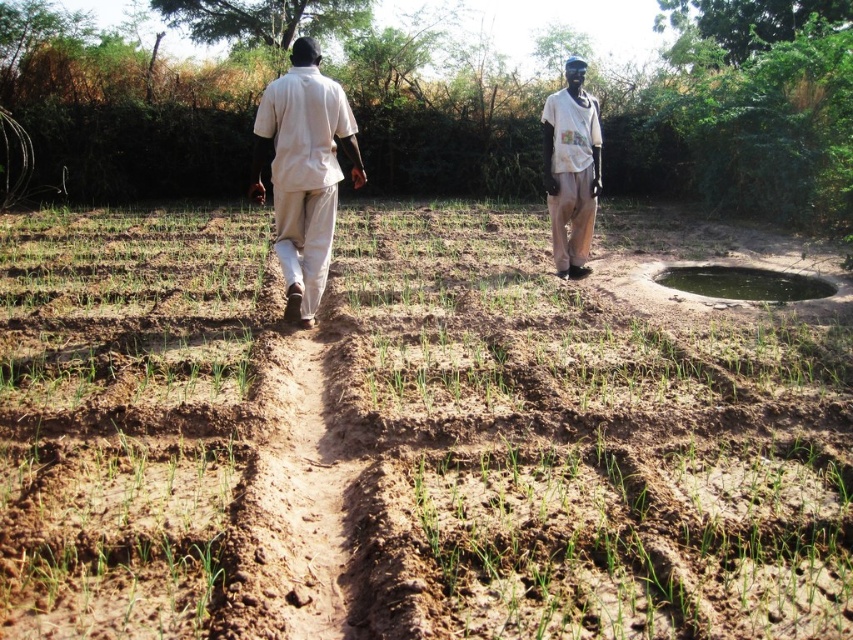
Who is shorter, light beige cotton shirt at center or white cotton shirt at upper center?

light beige cotton shirt at center

This screenshot has height=640, width=853. What do you see at coordinates (303, 172) in the screenshot? I see `light beige cotton shirt at center` at bounding box center [303, 172].

In order to click on light beige cotton shirt at center in this screenshot , I will do `click(303, 172)`.

Between point (196, 531) and point (558, 236), which one is positioned in front?

Point (196, 531)

What are the coordinates of `brown soil at center` in the screenshot? It's located at pos(415,433).

Where is `brown soil at center`? This screenshot has width=853, height=640. brown soil at center is located at coordinates (415, 433).

Can you confirm if beige cotton shirt at center is positioned above white cotton shirt at upper center?

Actually, beige cotton shirt at center is below white cotton shirt at upper center.

You are a GUI agent. You are given a task and a screenshot of the screen. Output one action in this format:
    pyautogui.click(x=<x>, y=<y>)
    Task: Click on the beige cotton shirt at center
    The image size is (853, 640).
    Given the screenshot: What is the action you would take?
    pyautogui.click(x=303, y=172)